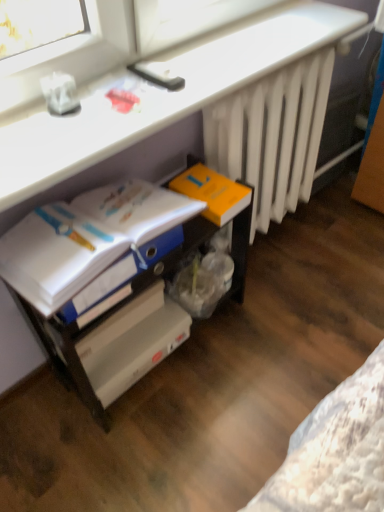
Question: Considering the positions of point (102, 225) and point (213, 221), is point (102, 225) closer or farther from the camera than point (213, 221)?

Choices:
 (A) farther
 (B) closer

Answer: (B)

Question: Is blue glossy folder at lower left inside the boundaries of orange matte paperback book at center-right, or outside?

Choices:
 (A) outside
 (B) inside

Answer: (A)

Question: Based on their relative distances, which object is nearer to the white plastic file cabinet at lower center?

Choices:
 (A) white plastic computer at lower left
 (B) orange matte paperback book at center-right
 (C) blue glossy folder at lower left
 (D) white matte radiator at right

Answer: (C)

Question: Considering the real-world distances, which object is farthest from the orange matte paperback book at center-right?

Choices:
 (A) white matte radiator at right
 (B) blue glossy folder at lower left
 (C) white plastic file cabinet at lower center
 (D) white plastic computer at lower left

Answer: (D)